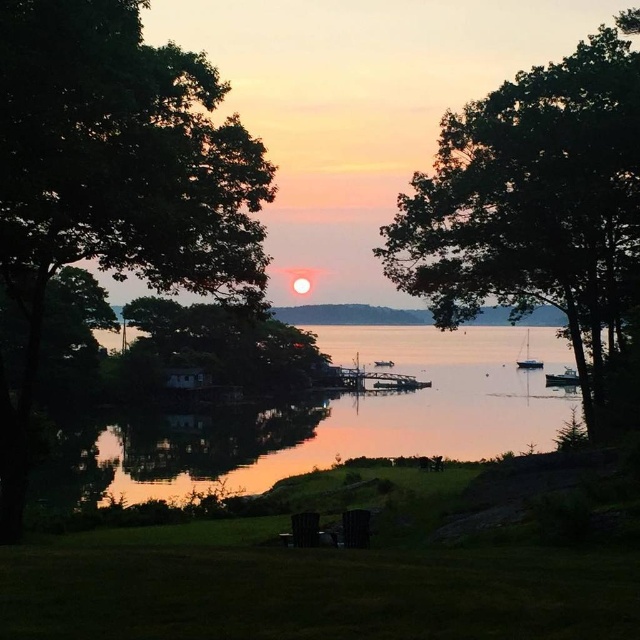
Question: Which point is farther to the camera?

Choices:
 (A) green leafy tree at center
 (B) green leafy tree at left
 (C) glistening water at center
 (D) wooden fishing boat at lower right

Answer: (D)

Question: Is glistening water at center to the right of wooden fishing boat at lower right from the viewer's perspective?

Choices:
 (A) no
 (B) yes

Answer: (A)

Question: Can you confirm if green leafy tree at left is smaller than wooden fishing boat at lower right?

Choices:
 (A) no
 (B) yes

Answer: (A)

Question: Does white glossy sailboat at center have a smaller size compared to metallic silver boat at center?

Choices:
 (A) yes
 (B) no

Answer: (B)

Question: Which object is farther from the camera taking this photo?

Choices:
 (A) glistening water at center
 (B) metallic silver boat at center
 (C) white glossy sailboat at center
 (D) green leafy tree at left

Answer: (C)

Question: Which point appears farthest from the camera in this image?

Choices:
 (A) (388, 362)
 (B) (573, 380)
 (C) (634, 218)

Answer: (A)